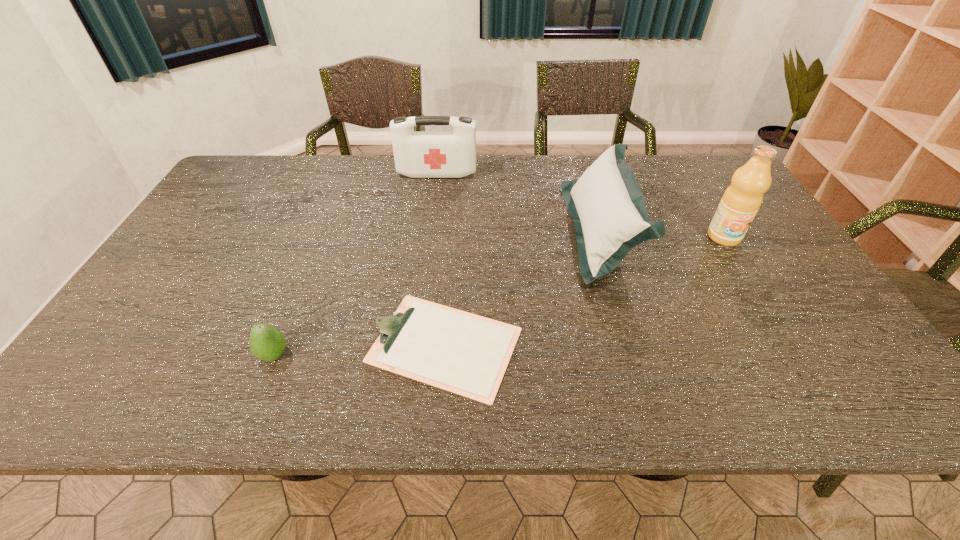
Identify which object is the second closest to the second shortest object. Please provide its 2D coordinates. Your answer should be formatted as a tuple, i.e. [(x, y)], where the tuple contains the x and y coordinates of a point satisfying the conditions above.

[(418, 154)]

You are a GUI agent. You are given a task and a screenshot of the screen. Output one action in this format:
    pyautogui.click(x=<x>, y=<y>)
    Task: Click on the object that is the second closest one to the fruit juice
    The width and height of the screenshot is (960, 540).
    Given the screenshot: What is the action you would take?
    pyautogui.click(x=466, y=354)